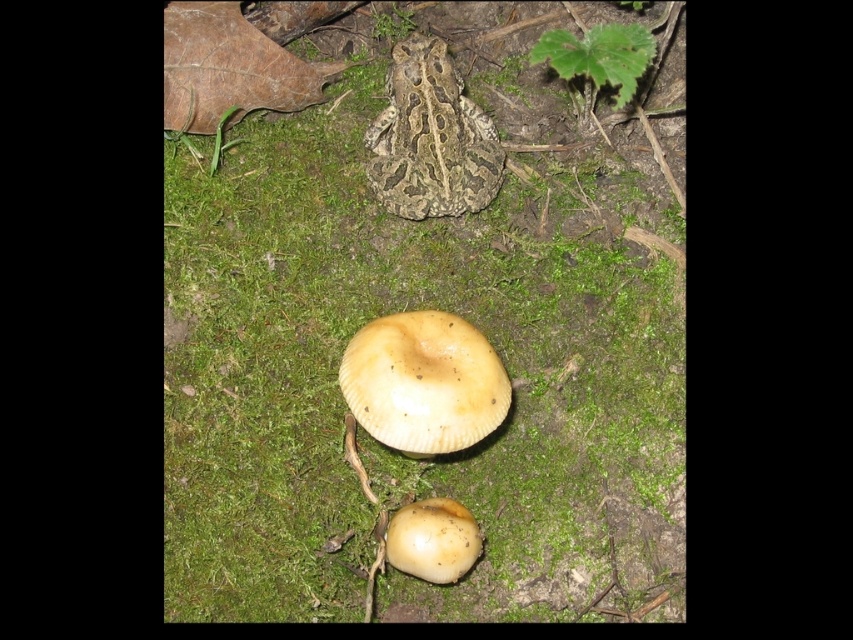
You are a photographer trying to capture both the light brown matte mushroom at center and the smooth beige mushroom at center in a single shot. Since you want both to be clearly visible, which mushroom should you focus on first to ensure the other remains in focus?

You should focus on the light brown matte mushroom at center first because the smooth beige mushroom at center is behind it, so by focusing on the closer object, the background one will still be in focus range.